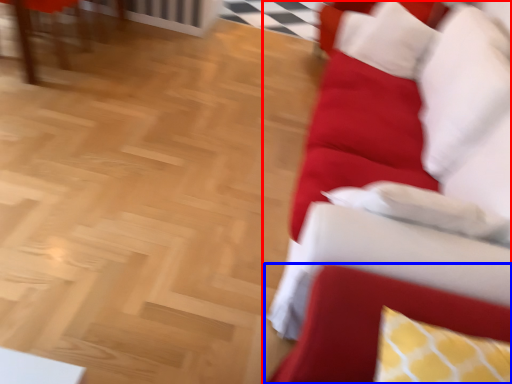
Question: Which object appears closest to the camera in this image, studio couch (highlighted by a red box) or swivel chair (highlighted by a blue box)?

Choices:
 (A) studio couch
 (B) swivel chair

Answer: (B)